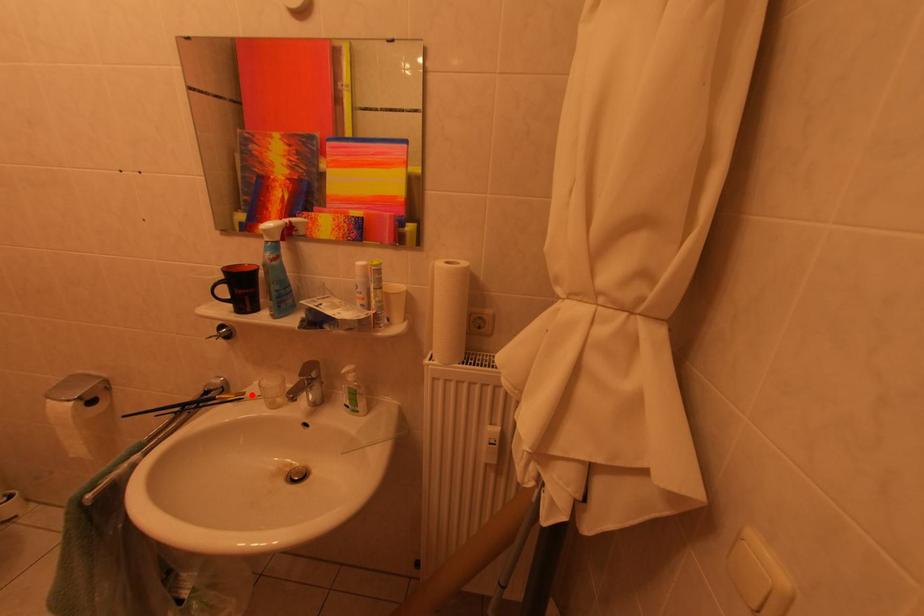
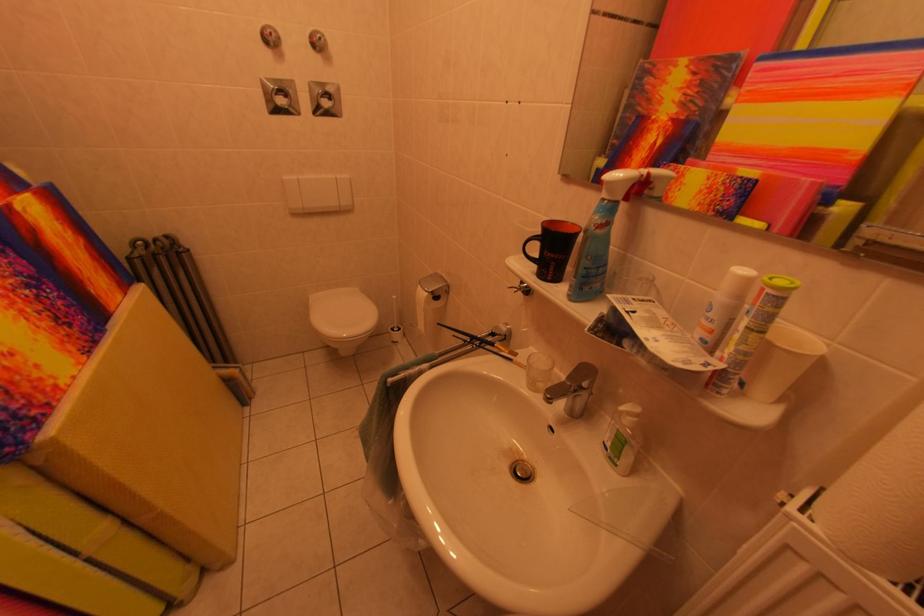
Find the pixel in the second image that matches the highlighted location in the first image.

(526, 355)